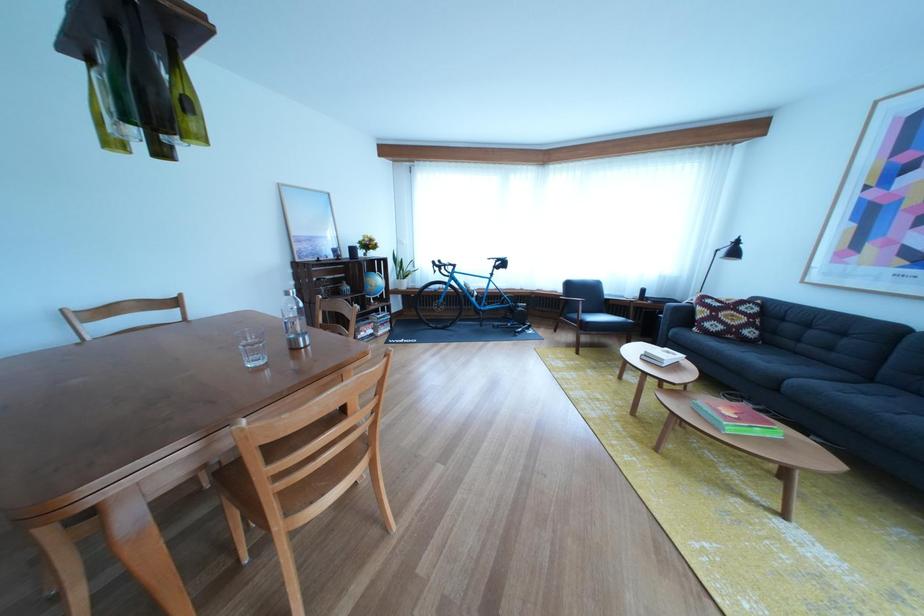
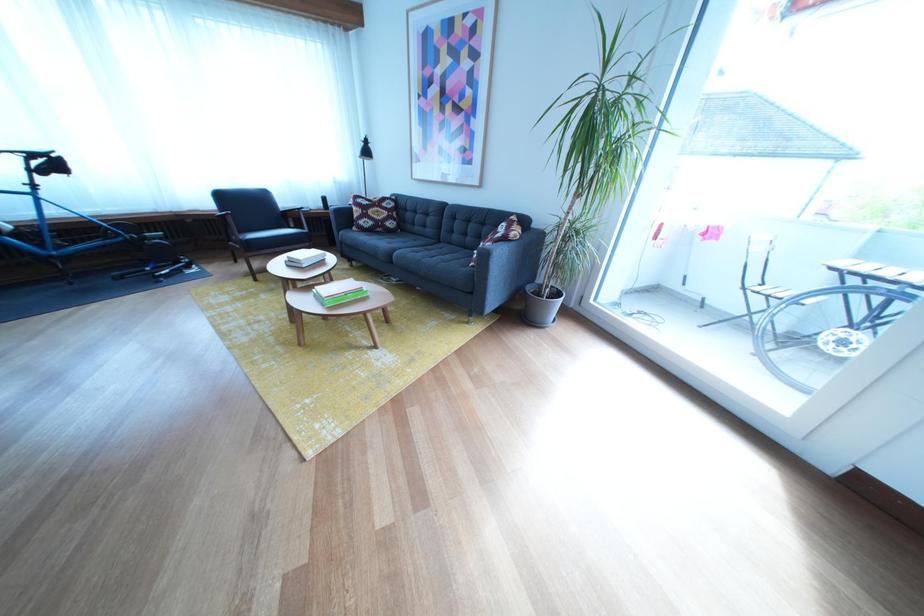
Locate, in the second image, the point that corresponds to (x=883, y=387) in the first image.

(453, 248)